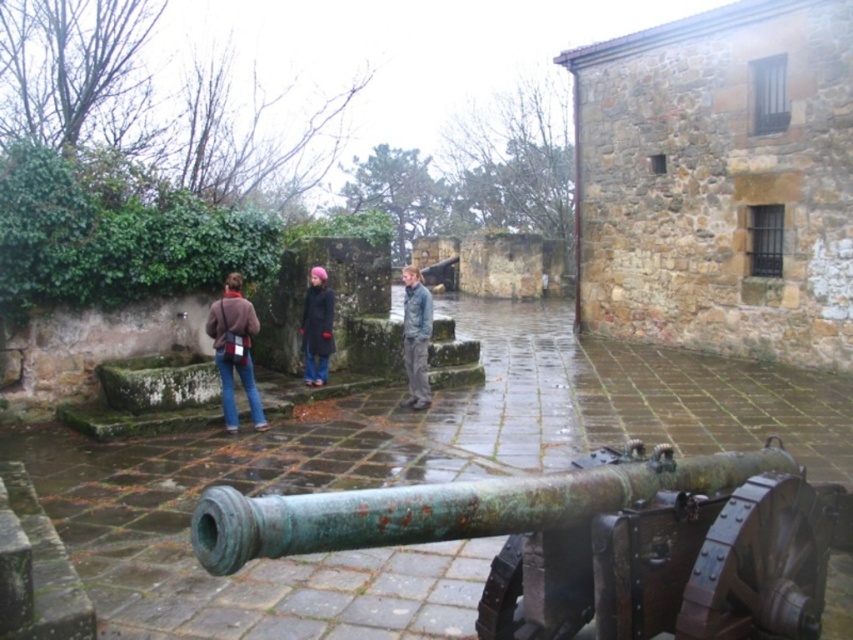
Describe the element at coordinates (583, 540) in the screenshot. This screenshot has width=853, height=640. I see `rusty green metal cannon at center` at that location.

Is rusty green metal cannon at center below dark blue coat at center?

Yes, rusty green metal cannon at center is below dark blue coat at center.

Which is behind, point (726, 608) or point (320, 348)?

The point (320, 348) is more distant.

This screenshot has height=640, width=853. Find the location of `rusty green metal cannon at center`. rusty green metal cannon at center is located at coordinates (583, 540).

Is rusty green metal cannon at center smaller than brown leather jacket at lower left?

No, rusty green metal cannon at center is not smaller than brown leather jacket at lower left.

Which is in front, point (758, 557) or point (241, 310)?

Point (758, 557) is in front.

Where is `rusty green metal cannon at center`? rusty green metal cannon at center is located at coordinates (583, 540).

Can you confirm if denim jacket at center is positioned to the left of dark blue coat at center?

In fact, denim jacket at center is to the right of dark blue coat at center.

Is point (413, 280) positioned in front of point (309, 326)?

That is True.

Which is behind, point (403, 352) or point (315, 385)?

The point (403, 352) is more distant.

The image size is (853, 640). I want to click on denim jacket at center, so click(x=416, y=337).